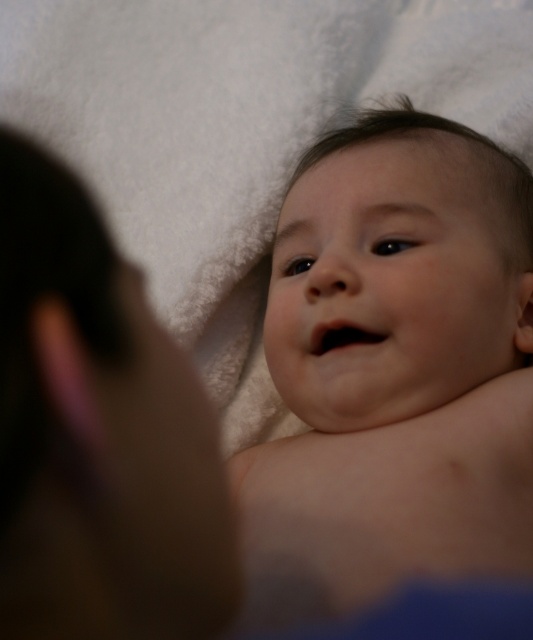
Question: Is smooth skin baby at center further to camera compared to brown skin at left?

Choices:
 (A) no
 (B) yes

Answer: (B)

Question: Can you confirm if smooth skin baby at center is bigger than brown skin at left?

Choices:
 (A) no
 (B) yes

Answer: (B)

Question: Can you confirm if smooth skin baby at center is positioned to the right of brown skin at left?

Choices:
 (A) yes
 (B) no

Answer: (A)